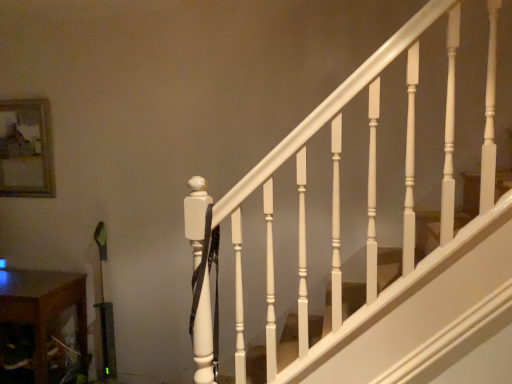
Describe the element at coordinates (42, 306) in the screenshot. I see `wooden at lower left` at that location.

Locate an element on the screen. Image resolution: width=512 pixels, height=384 pixels. wooden at lower left is located at coordinates (42, 306).

The width and height of the screenshot is (512, 384). What do you see at coordinates (26, 149) in the screenshot? I see `wooden frame at upper left` at bounding box center [26, 149].

The width and height of the screenshot is (512, 384). I want to click on wooden frame at upper left, so click(26, 149).

Identify the location of wooden at lower left. (42, 306).

Is wooden at lower left at the left side of wooden frame at upper left?

No.

Relative to wooden frame at upper left, is wooden at lower left in front or behind?

wooden at lower left is in front of wooden frame at upper left.

Is point (85, 300) closer to camera compared to point (27, 186)?

That is True.

From the image's perspective, does wooden at lower left appear higher than wooden frame at upper left?

No, from the image's perspective, wooden at lower left is not over wooden frame at upper left.

From a real-world perspective, is wooden at lower left on wooden frame at upper left?

No.

Based on the photo, is wooden at lower left wider than wooden frame at upper left?

Correct, the width of wooden at lower left exceeds that of wooden frame at upper left.

Is wooden at lower left taller or shorter than wooden frame at upper left?

wooden at lower left is taller than wooden frame at upper left.

Considering the relative sizes of wooden at lower left and wooden frame at upper left in the image provided, is wooden at lower left smaller than wooden frame at upper left?

No, wooden at lower left is not smaller than wooden frame at upper left.

Can we say wooden at lower left lies outside wooden frame at upper left?

Yes, wooden at lower left is located beyond the bounds of wooden frame at upper left.

Is wooden at lower left with wooden frame at upper left?

No, wooden at lower left is not beside wooden frame at upper left.

Is wooden at lower left turned away from wooden frame at upper left?

That's not correct — wooden at lower left is not looking away from wooden frame at upper left.

How different are the orientations of wooden at lower left and wooden frame at upper left in degrees?

The angular difference between wooden at lower left and wooden frame at upper left is 1.1 degrees.

How distant is wooden at lower left from wooden frame at upper left?

wooden at lower left and wooden frame at upper left are 33.89 inches apart from each other.

The width and height of the screenshot is (512, 384). I want to click on table located on the right of wooden frame at upper left, so click(x=42, y=306).

Which object is positioned more to the right, wooden frame at upper left or wooden at lower left?

From the viewer's perspective, wooden at lower left appears more on the right side.

Which object is closer to the camera taking this photo, wooden frame at upper left or wooden at lower left?

wooden at lower left is closer to the camera.

Considering the positions of point (12, 113) and point (49, 305), is point (12, 113) closer or farther from the camera than point (49, 305)?

Point (12, 113) appears to be farther away from the viewer than point (49, 305).

From the image's perspective, is wooden frame at upper left above or below wooden at lower left?

Clearly, from the image's perspective, wooden frame at upper left is above wooden at lower left.

From a real-world perspective, which is physically above, wooden frame at upper left or wooden at lower left?

wooden frame at upper left, from a real-world perspective.

Consider the image. Which of these two, wooden frame at upper left or wooden at lower left, is thinner?

A: Thinner between the two is wooden frame at upper left.

Does wooden frame at upper left have a greater height compared to wooden at lower left?

Incorrect, the height of wooden frame at upper left is not larger of that of wooden at lower left.

Is wooden frame at upper left bigger or smaller than wooden at lower left?

Considering their sizes, wooden frame at upper left takes up less space than wooden at lower left.

Is wooden frame at upper left inside or outside of wooden at lower left?

wooden frame at upper left is not inside wooden at lower left, it's outside.

Are wooden frame at upper left and wooden at lower left located far from each other?

No, there isn't a large distance between wooden frame at upper left and wooden at lower left.

Could you tell me if wooden frame at upper left is turned towards wooden at lower left?

No.

Locate an element on the screen. table that appears below the wooden frame at upper left (from the image's perspective) is located at coordinates (42, 306).

In the image, there is a wooden at lower left. Where is `picture frame above it (from the image's perspective)`? The width and height of the screenshot is (512, 384). picture frame above it (from the image's perspective) is located at coordinates (26, 149).

The width and height of the screenshot is (512, 384). Find the location of `table lying in front of the wooden frame at upper left`. table lying in front of the wooden frame at upper left is located at coordinates (x=42, y=306).